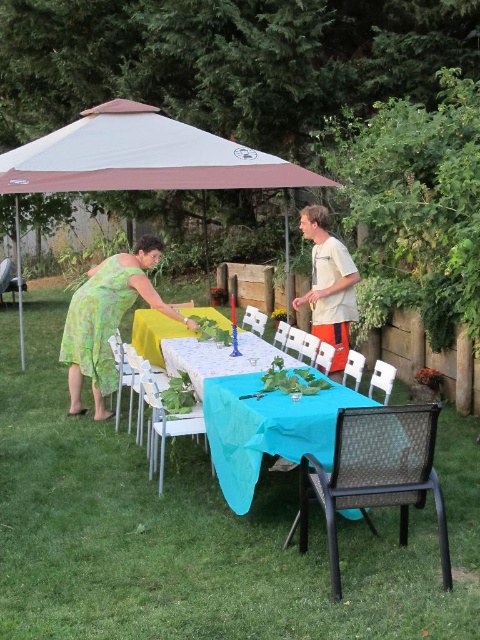
Question: Observing the image, what is the correct spatial positioning of brown fabric canopy at upper center in reference to green floral dress at center?

Choices:
 (A) left
 (B) right

Answer: (A)

Question: Can you confirm if brown fabric canopy at upper center is positioned below light gray t-shirt at center?

Choices:
 (A) yes
 (B) no

Answer: (B)

Question: Is the position of brown fabric canopy at upper center less distant than that of green floral dress at center?

Choices:
 (A) yes
 (B) no

Answer: (B)

Question: Which of these objects is positioned closest to the green floral dress at center?

Choices:
 (A) white fabric umbrella at upper center
 (B) light gray t-shirt at center

Answer: (B)

Question: Which object is farther from the camera taking this photo?

Choices:
 (A) white fabric umbrella at upper center
 (B) yellow fabric table at center

Answer: (A)

Question: Which point is farther to the camera?

Choices:
 (A) white fabric umbrella at upper center
 (B) light gray t-shirt at center
 (C) turquoise fabric table at center

Answer: (A)